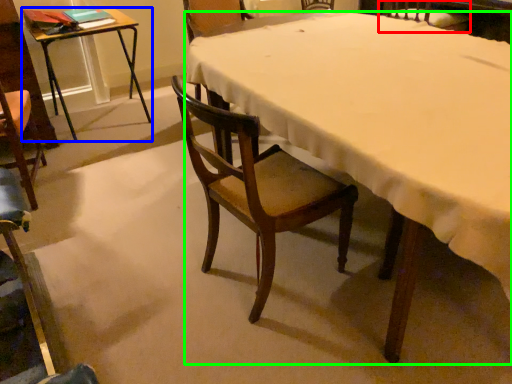
Question: Which is nearer to the chair (highlighted by a red box)? table (highlighted by a blue box) or desk (highlighted by a green box).

Choices:
 (A) table
 (B) desk

Answer: (B)